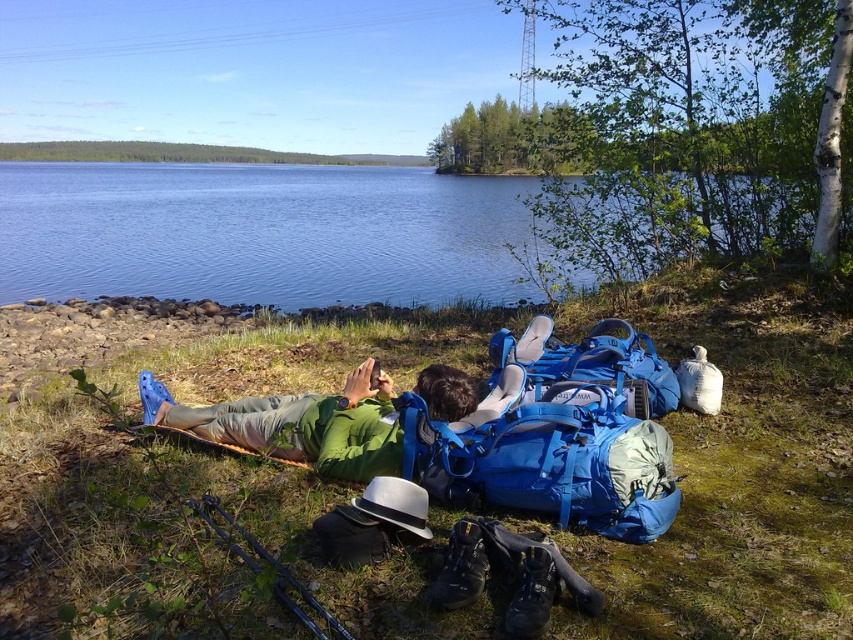
Looking at this image, you are standing at the camera position and want to pick up an item near the person. There are two points marked in the image, one at coordinates point (x=689, y=460) and the other at point (x=392, y=380). Which point is closer to you?

Point (x=689, y=460) is closer to the camera than point (x=392, y=380), so the item at point (x=689, y=460) is closer to you.

You are a hiker who wants to set up a tent. You see the green grass at lower center and the green fabric person at center. Which location is better for setting up your tent?

The green grass at lower center is to the right of the green fabric person at center, so it would be a better location for setting up the tent as it is farther away from the person and possibly more level ground.